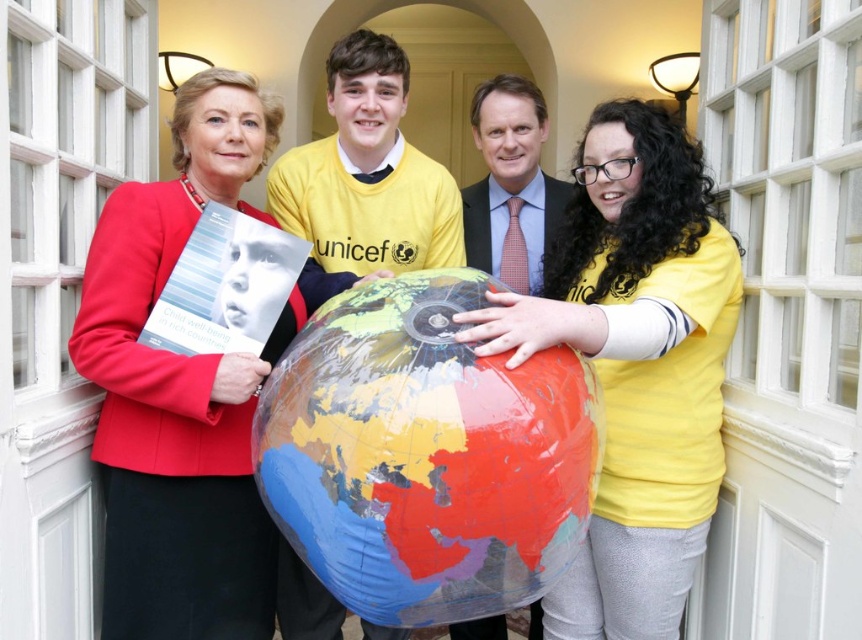
You are a photographer standing in front of the white arched doorway with glass panes. You need to take a photo of the smooth suit at center and the matte black suit at center. Which suit will appear larger in the photo?

The smooth suit at center will appear larger in the photo because it is closer to the viewer than the matte black suit at center.

Based on the photo, you are a photographer at a formal event. You need to capture a photo where the smooth suit at center is visible above the matte black suit at center. Given their heights, is this arrangement possible?

The smooth suit at center is much taller than the matte black suit at center, so arranging them so the smooth suit at center is visible above the matte black suit at center is possible.

Based on the scene description, where is the matte red blazer at left located in terms of its 2D coordinates?

The matte red blazer at left is located at the 2D coordinates of point (x=180, y=392).